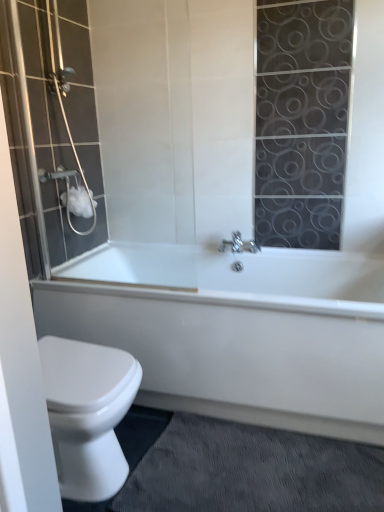
I want to click on vacant point above gray textured bath mat at lower right (from a real-world perspective), so click(248, 472).